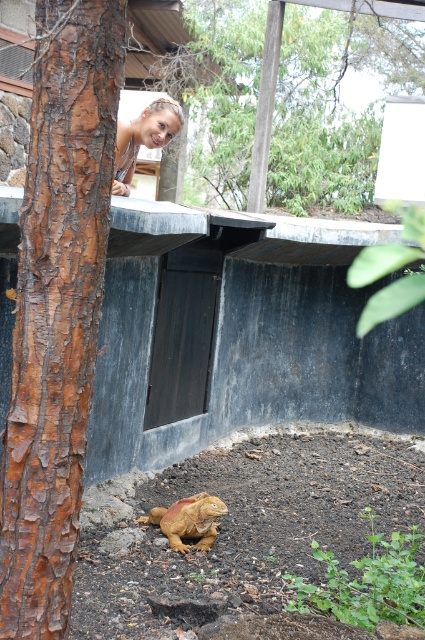
Question: Which object appears farthest from the camera in this image?

Choices:
 (A) brown matte statue at lower center
 (B) blonde hair at upper center

Answer: (B)

Question: Among these points, which one is nearest to the camera?

Choices:
 (A) (70, 51)
 (B) (138, 136)

Answer: (A)

Question: Among these points, which one is nearest to the camera?

Choices:
 (A) (210, 499)
 (B) (146, 134)
 (C) (84, 145)

Answer: (C)

Question: Does blonde hair at upper center have a lesser width compared to brown matte statue at lower center?

Choices:
 (A) no
 (B) yes

Answer: (B)

Question: Does brown rough bark at left have a larger size compared to brown matte statue at lower center?

Choices:
 (A) no
 (B) yes

Answer: (B)

Question: Can you confirm if brown rough bark at left is positioned above brown matte statue at lower center?

Choices:
 (A) no
 (B) yes

Answer: (B)